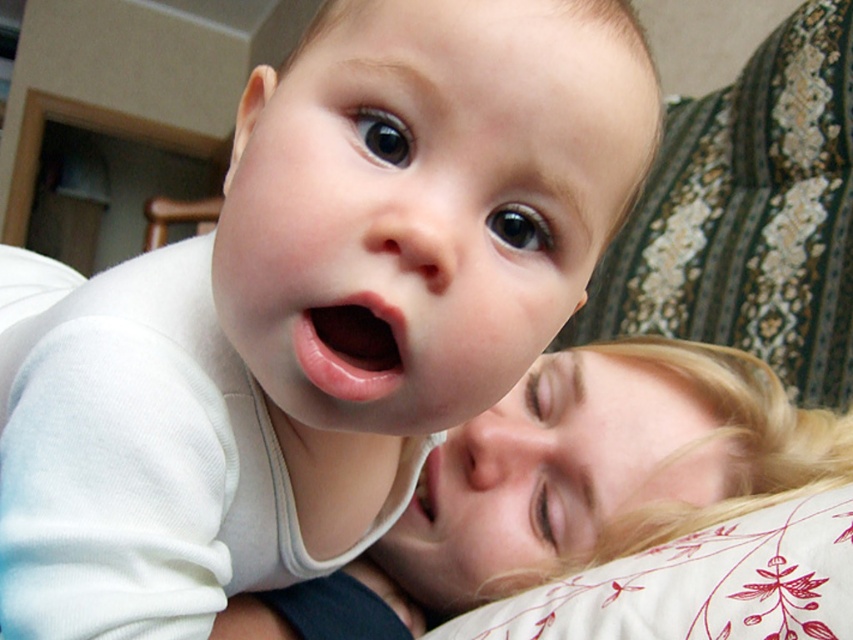
Who is shorter, smooth blonde hair at upper center or white floral pillow at lower right?

Standing shorter between the two is white floral pillow at lower right.

Is point (241, 636) closer to camera compared to point (688, 586)?

No.

Which is in front, point (660, 384) or point (440, 636)?

Point (440, 636) is in front.

At what (x,y) coordinates should I click in order to perform the action: click on smooth blonde hair at upper center. Please return your answer as a coordinate pair (x, y). The image size is (853, 640). Looking at the image, I should click on (598, 472).